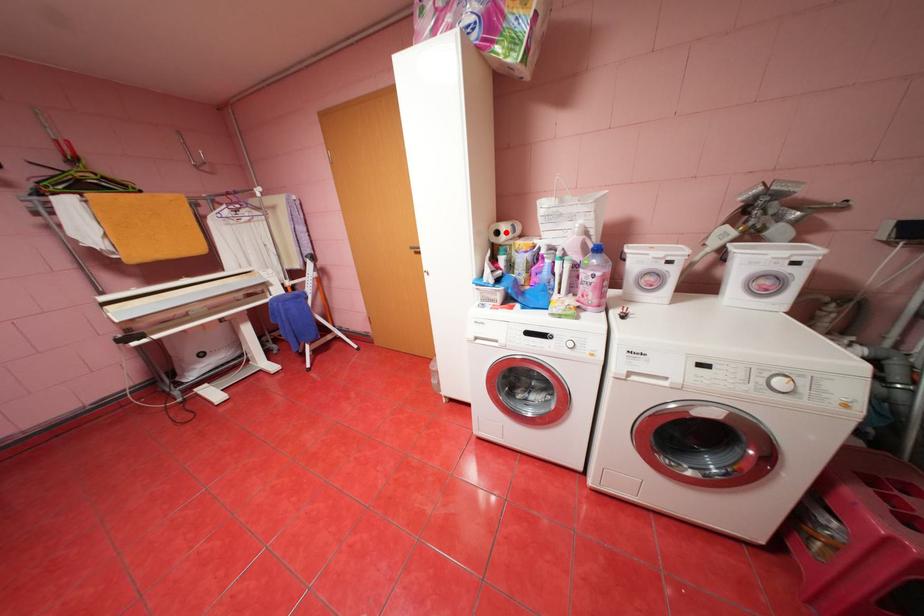
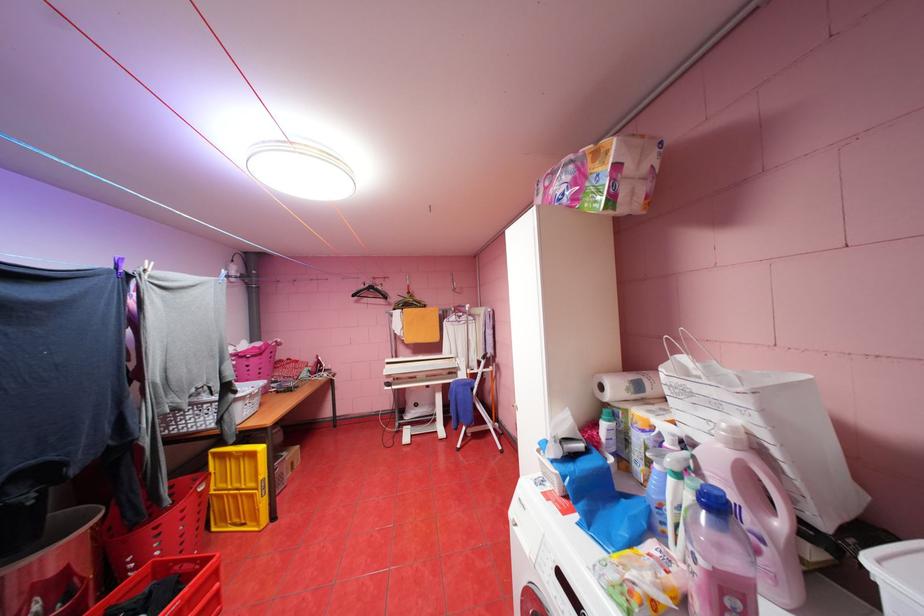
Where in the second image is the point corresponding to the highlighted location from the first image?

(610, 387)